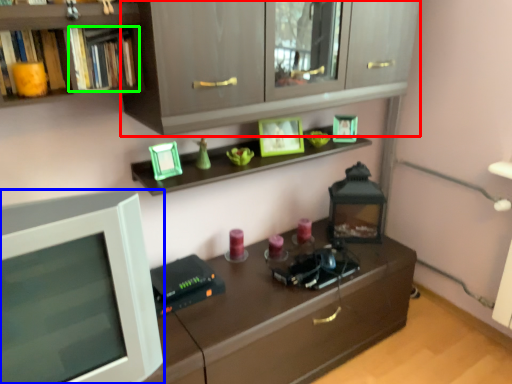
Question: Estimate the real-world distances between objects in this image. Which object is closer to cabinetry (highlighted by a red box), computer monitor (highlighted by a blue box) or book (highlighted by a green box)?

Choices:
 (A) computer monitor
 (B) book

Answer: (B)